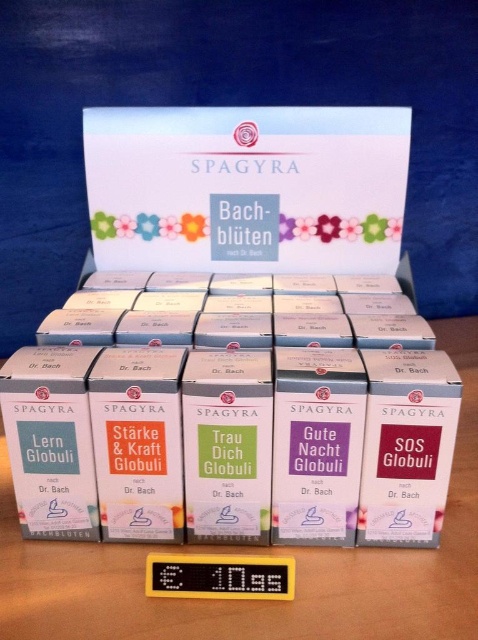
You are a delivery person who needs to place a new box of Bach flower remedy globules onto the display. The new box is 1.2 meters wide. Can you fit it between the white cardboard box at center and the camera without moving any existing items?

The distance between the white cardboard box at center and the camera is 1.13 meters. Since the new box is 1.2 meters wide, it cannot fit in the space provided as it is slightly wider than the available distance.

You are organizing a pharmacy shelf and see the white cardboard box at center and the white cardboard boxes at center. Which one is placed higher?

The white cardboard box at center is placed higher than the white cardboard boxes at center.

You are organizing a pharmacy shelf and see the white cardboard box at center and the white cardboard boxes at center. Which one is shorter?

The white cardboard box at center is shorter than the white cardboard boxes at center.